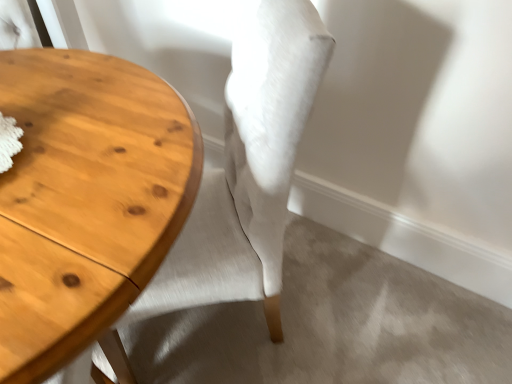
Question: Considering the relative positions of light brown wood table at left and light beige fabric chair at center in the image provided, is light brown wood table at left to the left or to the right of light beige fabric chair at center?

Choices:
 (A) left
 (B) right

Answer: (A)

Question: From a real-world perspective, is light brown wood table at left positioned above or below light beige fabric chair at center?

Choices:
 (A) above
 (B) below

Answer: (B)

Question: Considering the positions of point (143, 228) and point (167, 264), is point (143, 228) closer or farther from the camera than point (167, 264)?

Choices:
 (A) closer
 (B) farther

Answer: (A)

Question: Is light beige fabric chair at center bigger or smaller than light brown wood table at left?

Choices:
 (A) big
 (B) small

Answer: (B)

Question: Is light beige fabric chair at center inside the boundaries of light brown wood table at left, or outside?

Choices:
 (A) outside
 (B) inside

Answer: (B)

Question: Is light beige fabric chair at center taller or shorter than light brown wood table at left?

Choices:
 (A) tall
 (B) short

Answer: (A)

Question: From a real-world perspective, is light beige fabric chair at center positioned above or below light brown wood table at left?

Choices:
 (A) below
 (B) above

Answer: (B)